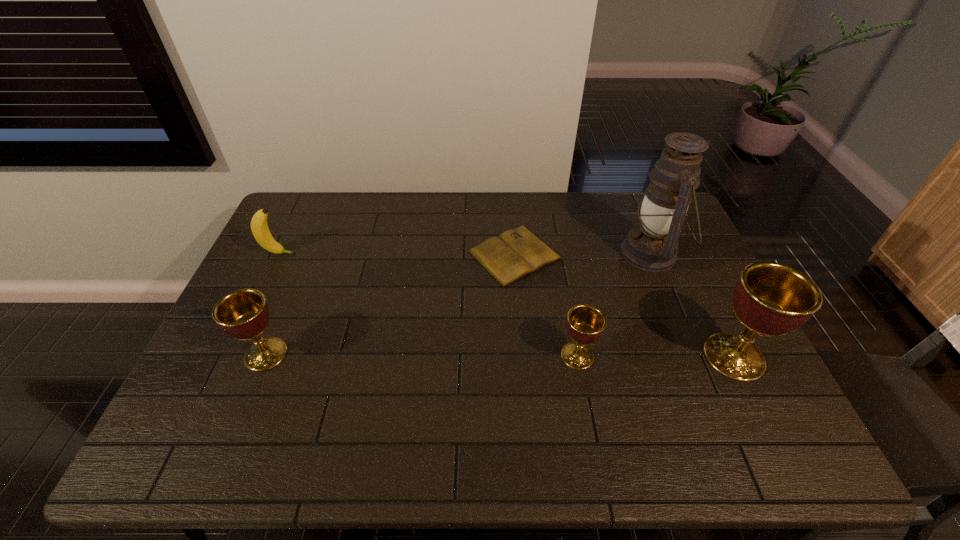
What are the coordinates of `vacant space located 0.400m on the back of the fifth shortest object` in the screenshot? It's located at (676, 237).

The height and width of the screenshot is (540, 960). In order to click on free space located on the front of the oil lamp in this screenshot , I will do `click(675, 310)`.

Identify the location of vacant space situated on the front of the shortest object. This screenshot has width=960, height=540. (522, 346).

Locate an element on the screen. This screenshot has height=540, width=960. vacant region located from the stem of the banana is located at coordinates (417, 254).

Locate an element on the screen. oil lamp present at the far edge is located at coordinates (652, 246).

The height and width of the screenshot is (540, 960). What are the coordinates of `book at the far edge` in the screenshot? It's located at click(x=515, y=253).

Find the location of a particular element. Image resolution: width=960 pixels, height=540 pixels. object that is at the near edge is located at coordinates (770, 299).

The height and width of the screenshot is (540, 960). In order to click on chalice at the left edge in this screenshot , I will do `click(243, 314)`.

Locate an element on the screen. Image resolution: width=960 pixels, height=540 pixels. banana that is at the left edge is located at coordinates (259, 227).

Identify the location of chalice that is at the right edge. (770, 299).